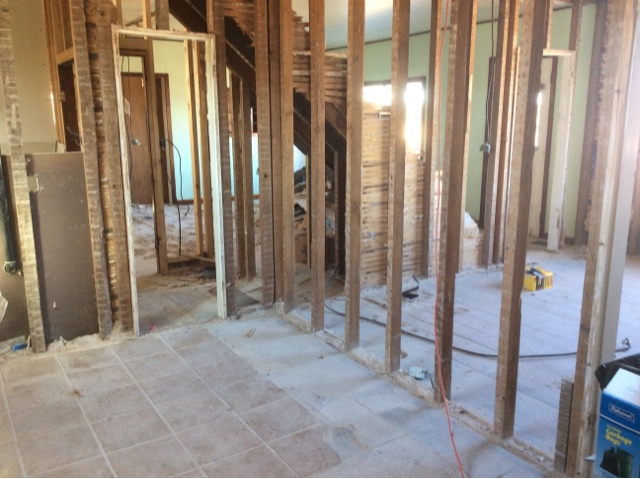
The width and height of the screenshot is (640, 479). I want to click on door frame, so click(219, 171), click(124, 166), click(189, 37).